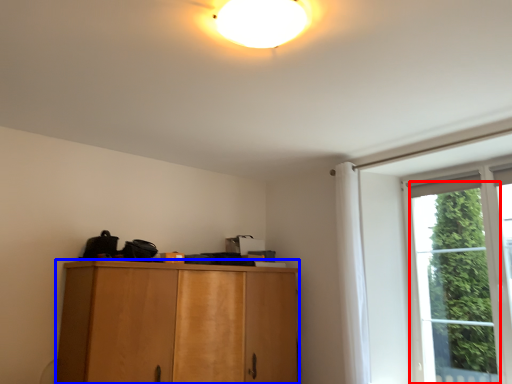
Question: Which object is closer to the camera taking this photo, window (highlighted by a red box) or cabinetry (highlighted by a blue box)?

Choices:
 (A) window
 (B) cabinetry

Answer: (B)